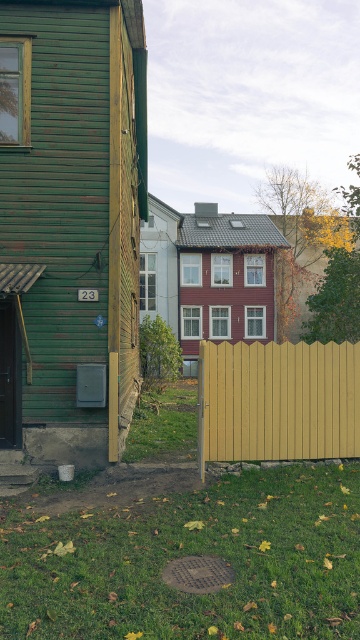
Question: Which object appears closest to the camera in this image?

Choices:
 (A) green grass at lower center
 (B) yellow wood fence at center

Answer: (A)

Question: Does green grass at lower center come in front of yellow wood fence at center?

Choices:
 (A) no
 (B) yes

Answer: (B)

Question: Is green grass at lower center closer to camera compared to yellow wood fence at center?

Choices:
 (A) yes
 (B) no

Answer: (A)

Question: Is green grass at lower center closer to the viewer compared to yellow wood fence at center?

Choices:
 (A) no
 (B) yes

Answer: (B)

Question: Which point is farther to the camera?

Choices:
 (A) (59, 616)
 (B) (236, 404)

Answer: (B)

Question: Which of the following is the closest to the observer?

Choices:
 (A) green grass at lower center
 (B) yellow wood fence at center

Answer: (A)